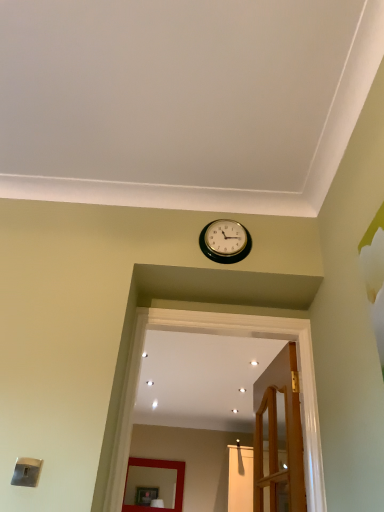
Question: Can you confirm if wooden door at center is shorter than gold metallic wall clock at upper center?

Choices:
 (A) yes
 (B) no

Answer: (B)

Question: Is wooden door at center positioned with its back to gold metallic wall clock at upper center?

Choices:
 (A) no
 (B) yes

Answer: (A)

Question: From the image's perspective, is wooden door at center above gold metallic wall clock at upper center?

Choices:
 (A) yes
 (B) no

Answer: (B)

Question: Would you say wooden door at center is outside gold metallic wall clock at upper center?

Choices:
 (A) yes
 (B) no

Answer: (A)

Question: From a real-world perspective, is wooden door at center beneath gold metallic wall clock at upper center?

Choices:
 (A) yes
 (B) no

Answer: (A)

Question: Is wooden door at center to the right of gold metallic wall clock at upper center from the viewer's perspective?

Choices:
 (A) no
 (B) yes

Answer: (B)

Question: Does matte red mirror at center have a greater width compared to gold metallic wall clock at upper center?

Choices:
 (A) no
 (B) yes

Answer: (B)

Question: Is matte red mirror at center positioned in front of gold metallic wall clock at upper center?

Choices:
 (A) yes
 (B) no

Answer: (B)

Question: Is matte red mirror at center shorter than gold metallic wall clock at upper center?

Choices:
 (A) yes
 (B) no

Answer: (B)

Question: Does matte red mirror at center have a lesser width compared to gold metallic wall clock at upper center?

Choices:
 (A) yes
 (B) no

Answer: (B)

Question: Is matte red mirror at center next to gold metallic wall clock at upper center and touching it?

Choices:
 (A) yes
 (B) no

Answer: (B)

Question: From a real-world perspective, is matte red mirror at center positioned under gold metallic wall clock at upper center based on gravity?

Choices:
 (A) no
 (B) yes

Answer: (B)

Question: Would you say gold metallic wall clock at upper center is outside wooden door at center?

Choices:
 (A) yes
 (B) no

Answer: (A)